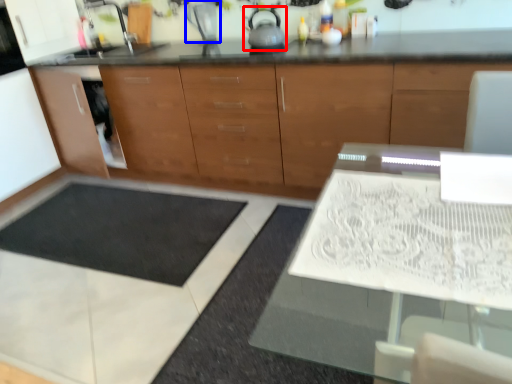
Question: Which object is further to the camera taking this photo, tea pot (highlighted by a red box) or appliance (highlighted by a blue box)?

Choices:
 (A) tea pot
 (B) appliance

Answer: (B)